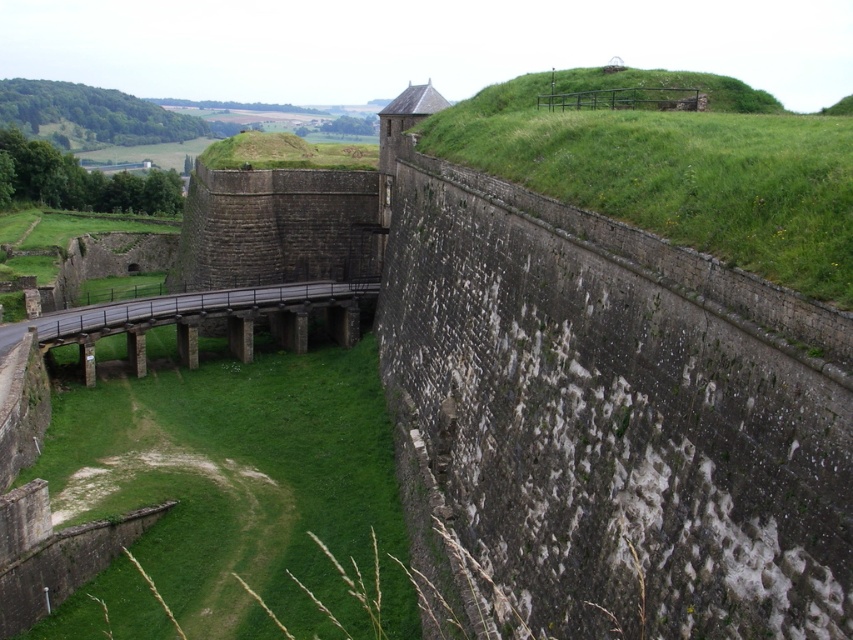
Question: Which of the following is the farthest from the observer?

Choices:
 (A) green grassy hill at upper right
 (B) green grassy at lower left
 (C) brown stone bridge at center

Answer: (C)

Question: Can you confirm if green grassy at lower left is thinner than brown stone bridge at center?

Choices:
 (A) no
 (B) yes

Answer: (A)

Question: Which point appears farthest from the camera in this image?

Choices:
 (A) (209, 536)
 (B) (183, 316)
 (C) (727, 260)

Answer: (B)

Question: Which point is farther from the camera taking this photo?

Choices:
 (A) (318, 406)
 (B) (178, 332)

Answer: (B)

Question: Can you confirm if green grassy hill at upper right is wider than brown stone bridge at center?

Choices:
 (A) yes
 (B) no

Answer: (A)

Question: Can you confirm if green grassy at lower left is bigger than brown stone bridge at center?

Choices:
 (A) no
 (B) yes

Answer: (B)